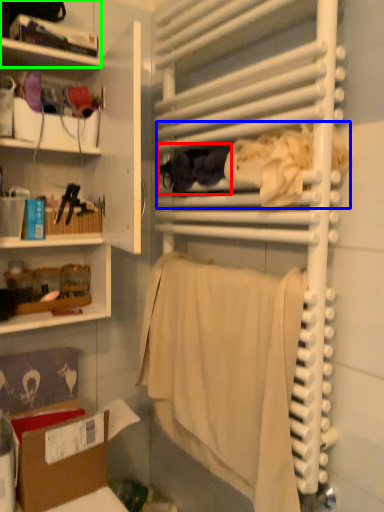
Question: Based on their relative distances, which object is farther from clothing (highlighted by a red box)? Choose from clothing (highlighted by a blue box) and shelf (highlighted by a green box).

Choices:
 (A) clothing
 (B) shelf

Answer: (B)